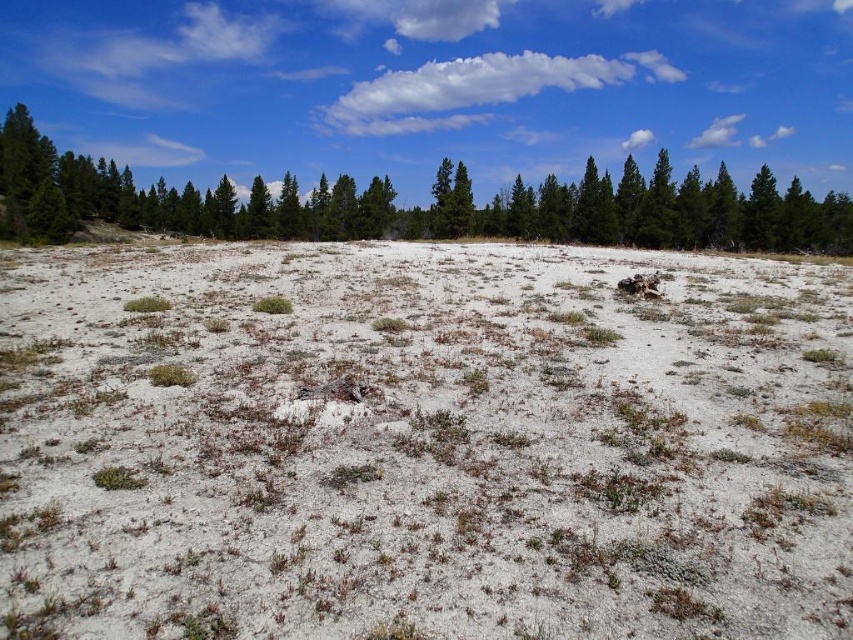
Question: Is white sandy plain at center wider than green textured pine at upper center?

Choices:
 (A) yes
 (B) no

Answer: (B)

Question: Among these points, which one is farthest from the camera?

Choices:
 (A) (817, 342)
 (B) (125, 195)

Answer: (B)

Question: Does white sandy plain at center come in front of green textured pine at upper center?

Choices:
 (A) no
 (B) yes

Answer: (B)

Question: Which of the following is the closest to the observer?

Choices:
 (A) (801, 266)
 (B) (619, 189)

Answer: (A)

Question: Can you confirm if white sandy plain at center is smaller than green textured pine at upper center?

Choices:
 (A) yes
 (B) no

Answer: (A)

Question: Which point is closer to the camera taking this photo?

Choices:
 (A) (595, 193)
 (B) (271, 612)

Answer: (B)